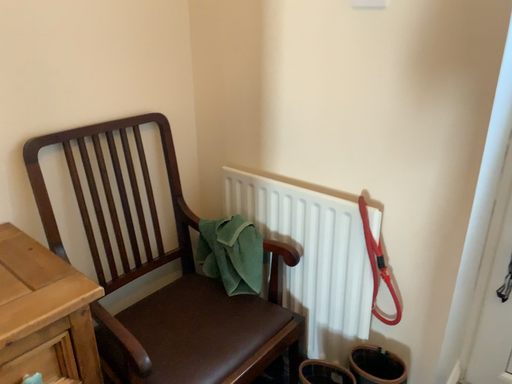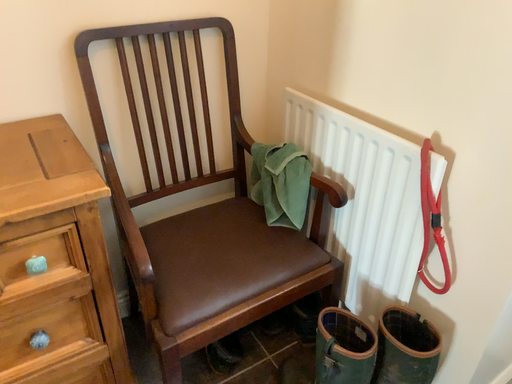
Question: How did the camera likely rotate when shooting the video?

Choices:
 (A) rotated upward
 (B) rotated downward

Answer: (B)